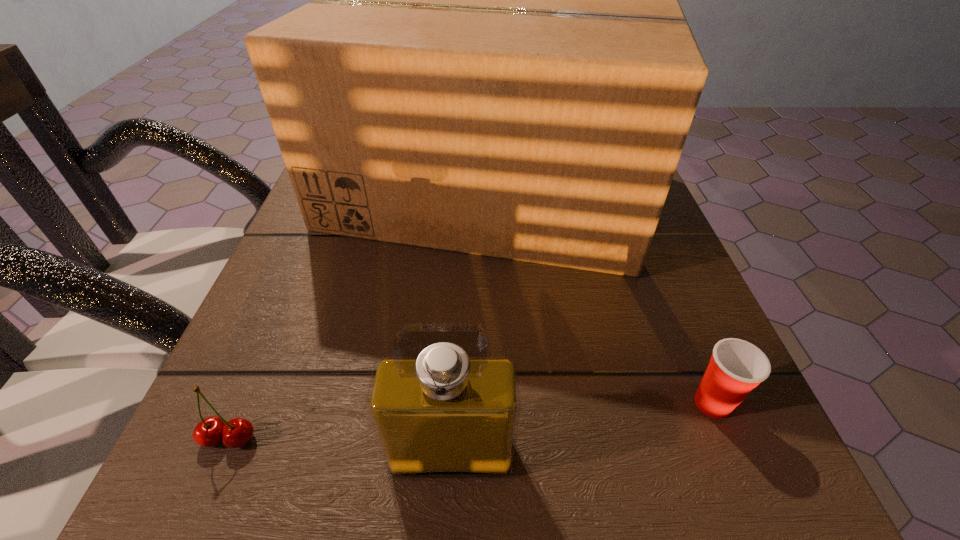
Find the location of a particular element. This screenshot has width=960, height=540. blank space that satisfies the following two spatial constraints: 1. on the front side of the Dixie cup; 2. on the left side of the tallest object is located at coordinates (489, 403).

At what (x,y) coordinates should I click in order to perform the action: click on vacant region that satisfies the following two spatial constraints: 1. on the front side of the box; 2. on the right side of the Dixie cup. Please return your answer as a coordinate pair (x, y). This screenshot has width=960, height=540. Looking at the image, I should click on pos(489,403).